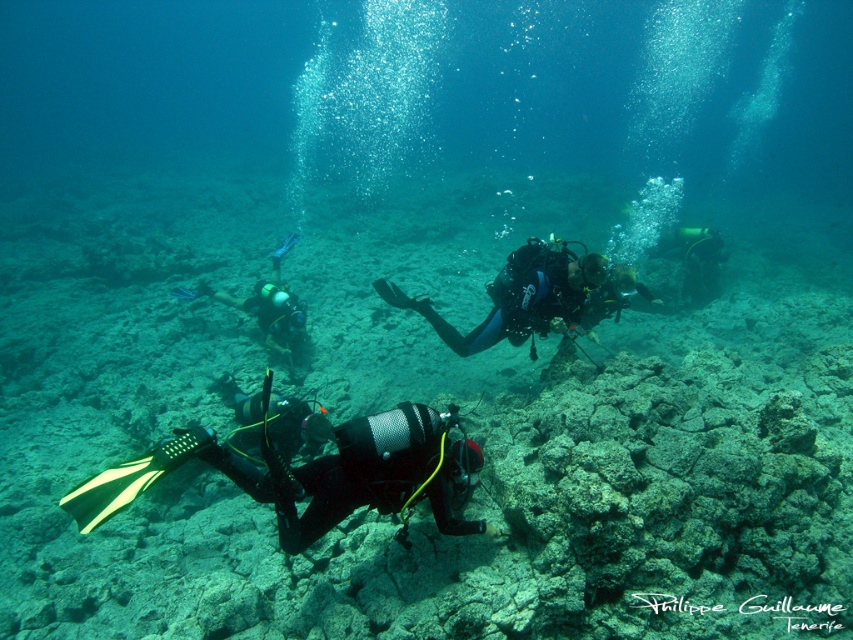
Which is in front, point (511, 262) or point (287, 337)?

Point (511, 262) is more forward.

Does blue matte scuba diver at center come in front of matte black wetsuit at center?

Yes.

Does point (469, 332) come closer to viewer compared to point (271, 256)?

Yes, it is in front of point (271, 256).

Locate an element on the screen. The width and height of the screenshot is (853, 640). blue matte scuba diver at center is located at coordinates (518, 296).

Does black mesh wetsuit at center appear on the right side of blue matte scuba diver at center?

In fact, black mesh wetsuit at center is to the left of blue matte scuba diver at center.

Between black mesh wetsuit at center and blue matte scuba diver at center, which one is positioned lower?

black mesh wetsuit at center is lower down.

The width and height of the screenshot is (853, 640). Identify the location of black mesh wetsuit at center. pos(360,474).

Is black mesh wetsuit at center bigger than matte black wetsuit at center?

Incorrect, black mesh wetsuit at center is not larger than matte black wetsuit at center.

Does black mesh wetsuit at center have a smaller size compared to matte black wetsuit at center?

Correct, black mesh wetsuit at center occupies less space than matte black wetsuit at center.

Does point (370, 492) come behind point (299, 301)?

No, it is not.

Locate an element on the screen. The height and width of the screenshot is (640, 853). black mesh wetsuit at center is located at coordinates (360, 474).